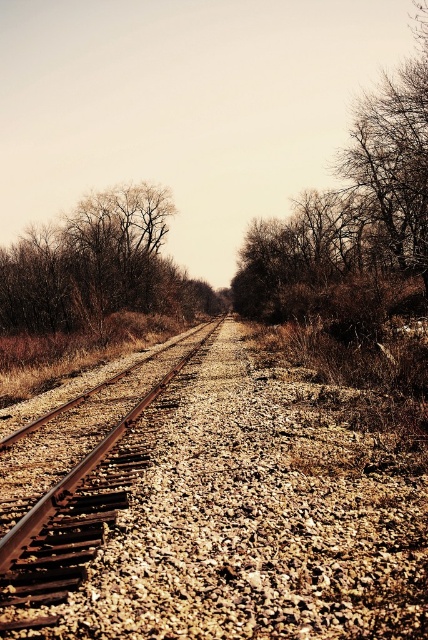
Question: Is bare branches at upper left below rusty metal train track at center?

Choices:
 (A) yes
 (B) no

Answer: (B)

Question: Which point is closer to the camera?

Choices:
 (A) bare branches at upper left
 (B) rusty metal train track at center

Answer: (B)

Question: Estimate the real-world distances between objects in this image. Which object is closer to the bare branches at upper left?

Choices:
 (A) bare branches at center
 (B) rusty metal train track at center

Answer: (A)

Question: Is bare branches at center thinner than rusty metal train track at center?

Choices:
 (A) no
 (B) yes

Answer: (A)

Question: Is the position of bare branches at upper left less distant than that of rusty metal train track at center?

Choices:
 (A) yes
 (B) no

Answer: (B)

Question: Which object appears closest to the camera in this image?

Choices:
 (A) bare branches at upper left
 (B) bare branches at center
 (C) rusty metal train track at center

Answer: (C)